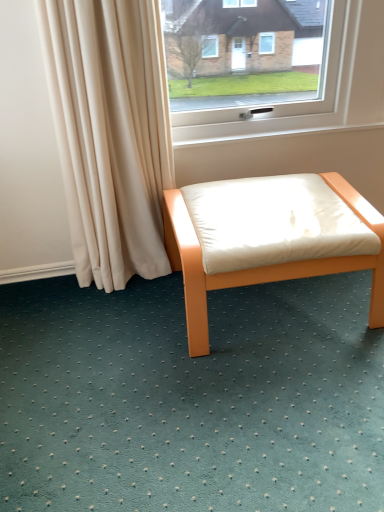
The height and width of the screenshot is (512, 384). In order to click on matte orange stool at center in this screenshot , I will do `click(262, 242)`.

Image resolution: width=384 pixels, height=512 pixels. What do you see at coordinates (262, 242) in the screenshot?
I see `matte orange stool at center` at bounding box center [262, 242].

The width and height of the screenshot is (384, 512). I want to click on matte orange stool at center, so click(262, 242).